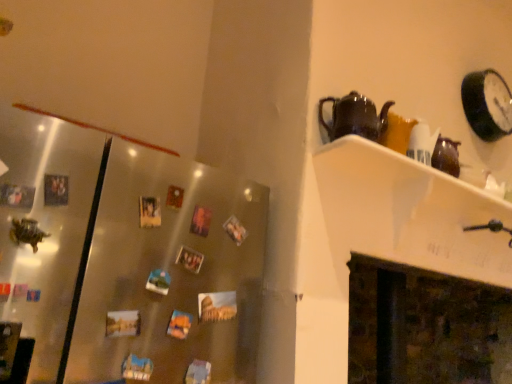
Question: Visually, is white glossy shelf at upper right positioned to the left or to the right of satin metallic fridge at left?

Choices:
 (A) right
 (B) left

Answer: (A)

Question: In the image, is white glossy shelf at upper right positioned in front of or behind satin metallic fridge at left?

Choices:
 (A) front
 (B) behind

Answer: (B)

Question: Estimate the real-world distances between objects in this image. Which object is closer to the black glossy clock at upper right?

Choices:
 (A) white glossy shelf at upper right
 (B) satin metallic fridge at left
 (C) dark brown stone fireplace at lower right
 (D) black glossy teapot at upper right

Answer: (A)

Question: Estimate the real-world distances between objects in this image. Which object is farther from the black glossy teapot at upper right?

Choices:
 (A) dark brown stone fireplace at lower right
 (B) satin metallic fridge at left
 (C) black glossy clock at upper right
 (D) white glossy shelf at upper right

Answer: (A)